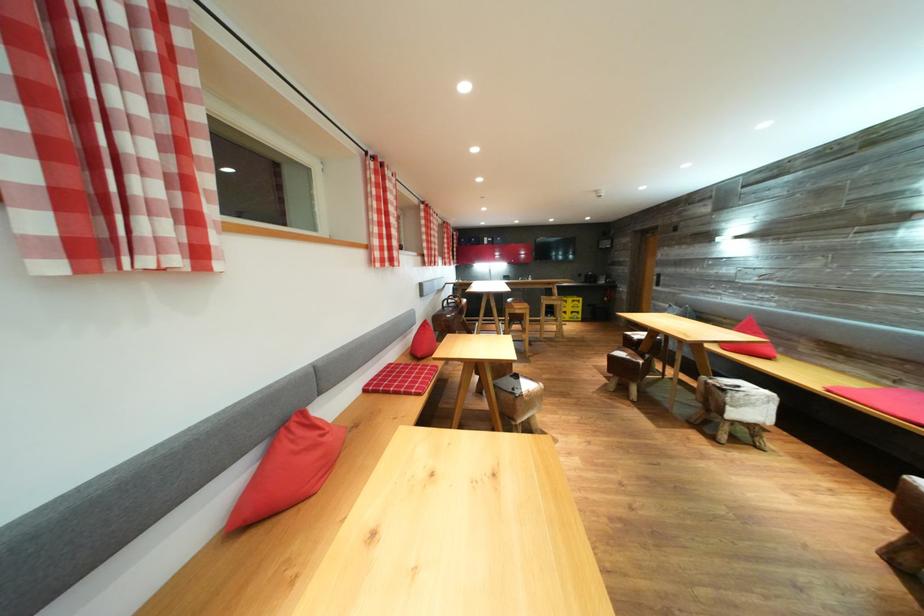
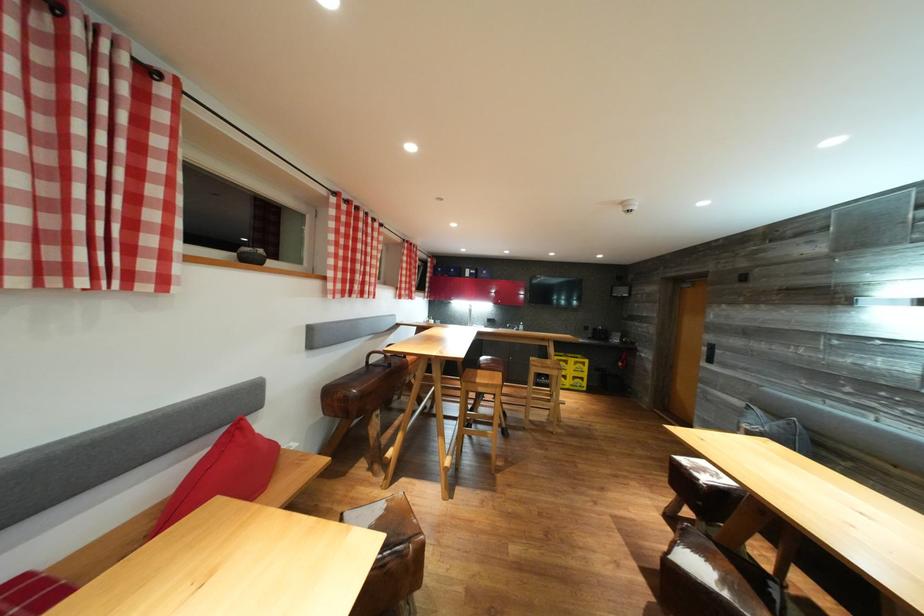
Where in the second image is the point corresponding to [527,314] from the first image?

(492, 391)